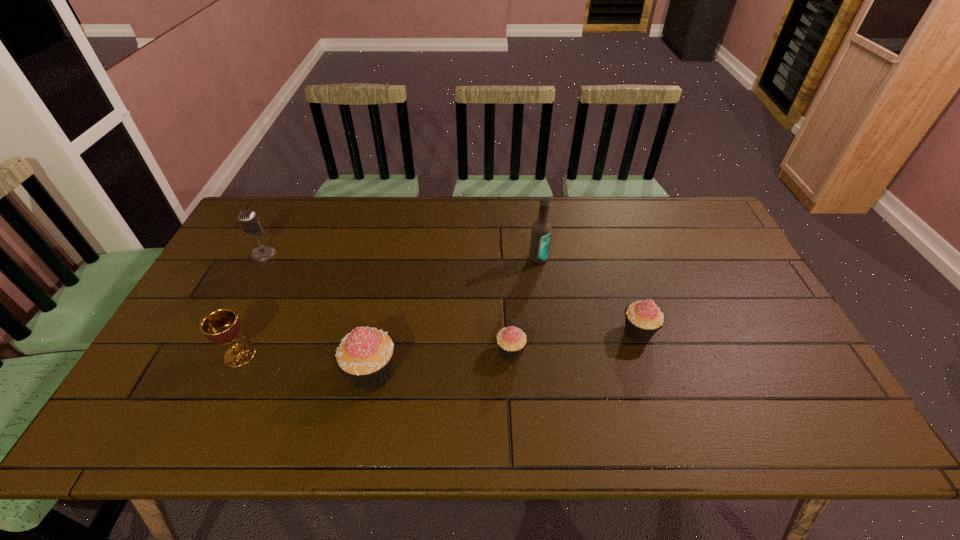
Find the location of a particular element. The height and width of the screenshot is (540, 960). vacant space that satisfies the following two spatial constraints: 1. on the side of the beer bottle with the label; 2. on the left side of the rightmost cupcake is located at coordinates (548, 332).